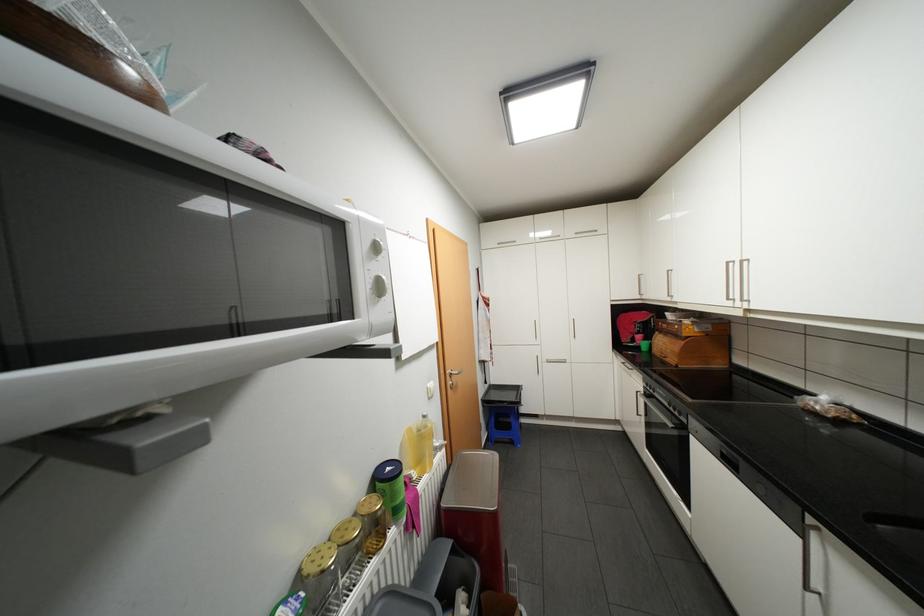
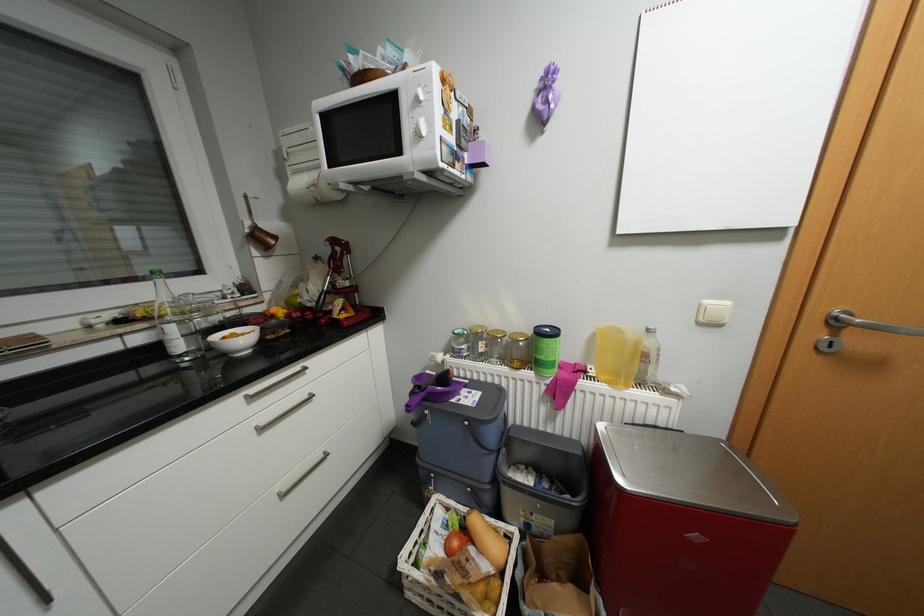
First-person continuous shooting, in which direction is the camera rotating?

The camera's rotation is toward left-down.